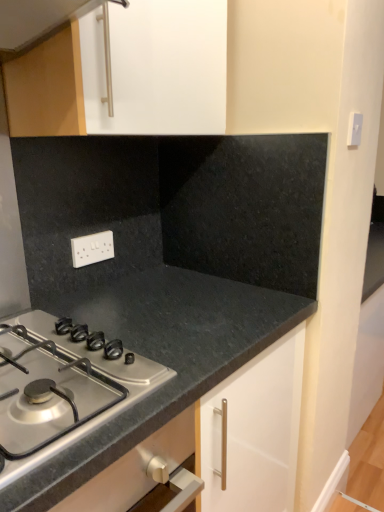
Question: Does black granite countertop at center have a smaller size compared to white plastic electric outlet at center?

Choices:
 (A) no
 (B) yes

Answer: (A)

Question: From a real-world perspective, does black granite countertop at center stand above white plastic electric outlet at center?

Choices:
 (A) yes
 (B) no

Answer: (B)

Question: Is black granite countertop at center aimed at white plastic electric outlet at center?

Choices:
 (A) no
 (B) yes

Answer: (A)

Question: From the image's perspective, does black granite countertop at center appear higher than white plastic electric outlet at center?

Choices:
 (A) yes
 (B) no

Answer: (B)

Question: Is black granite countertop at center positioned in front of white plastic electric outlet at center?

Choices:
 (A) yes
 (B) no

Answer: (A)

Question: Considering the positions of satin silver gas stove at lower left and white plastic electric outlet at center in the image, is satin silver gas stove at lower left bigger or smaller than white plastic electric outlet at center?

Choices:
 (A) big
 (B) small

Answer: (A)

Question: Is point (8, 403) positioned closer to the camera than point (84, 263)?

Choices:
 (A) closer
 (B) farther

Answer: (A)

Question: Based on their positions, is satin silver gas stove at lower left located to the left or right of white plastic electric outlet at center?

Choices:
 (A) right
 (B) left

Answer: (B)

Question: Considering the positions of satin silver gas stove at lower left and white plastic electric outlet at center in the image, is satin silver gas stove at lower left taller or shorter than white plastic electric outlet at center?

Choices:
 (A) tall
 (B) short

Answer: (B)

Question: Is white plastic electric outlet at center taller or shorter than satin silver gas stove at lower left?

Choices:
 (A) short
 (B) tall

Answer: (B)

Question: Considering the positions of white plastic electric outlet at center and satin silver gas stove at lower left in the image, is white plastic electric outlet at center bigger or smaller than satin silver gas stove at lower left?

Choices:
 (A) small
 (B) big

Answer: (A)

Question: Would you say white plastic electric outlet at center is inside or outside satin silver gas stove at lower left?

Choices:
 (A) inside
 (B) outside

Answer: (B)

Question: Is white plastic electric outlet at center in front of or behind satin silver gas stove at lower left in the image?

Choices:
 (A) front
 (B) behind

Answer: (B)

Question: Do you think white plastic electric outlet at center is within black granite countertop at center, or outside of it?

Choices:
 (A) outside
 (B) inside

Answer: (A)

Question: Is white plastic electric outlet at center bigger or smaller than black granite countertop at center?

Choices:
 (A) small
 (B) big

Answer: (A)